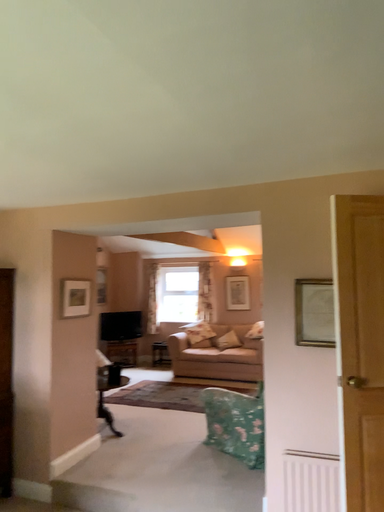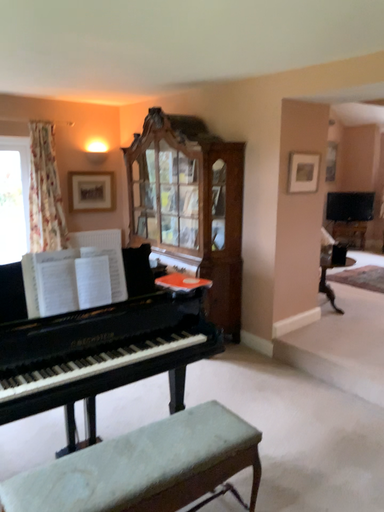
Question: How did the camera likely rotate when shooting the video?

Choices:
 (A) rotated upward
 (B) rotated downward

Answer: (B)